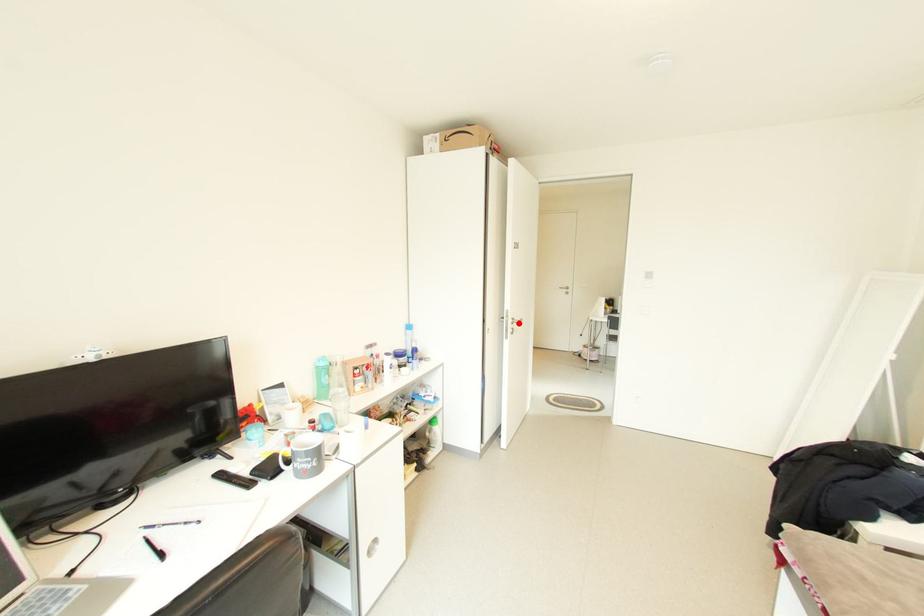
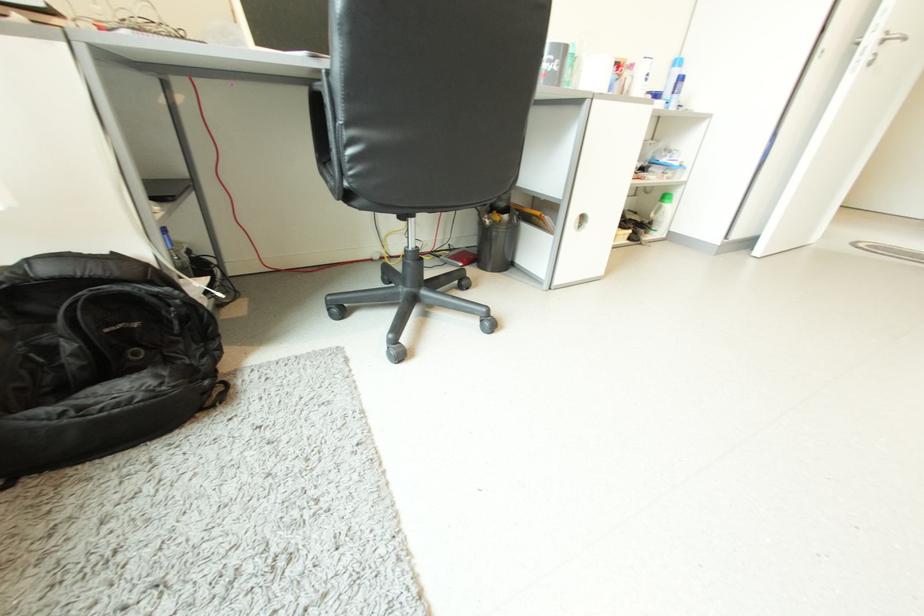
In the second image, find the point that corresponds to the highlighted location in the first image.

(886, 41)